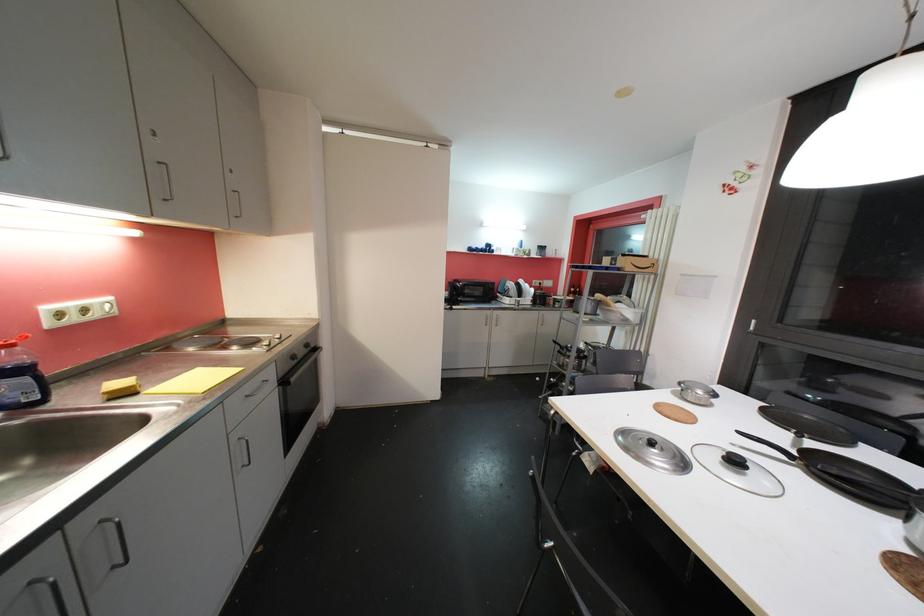
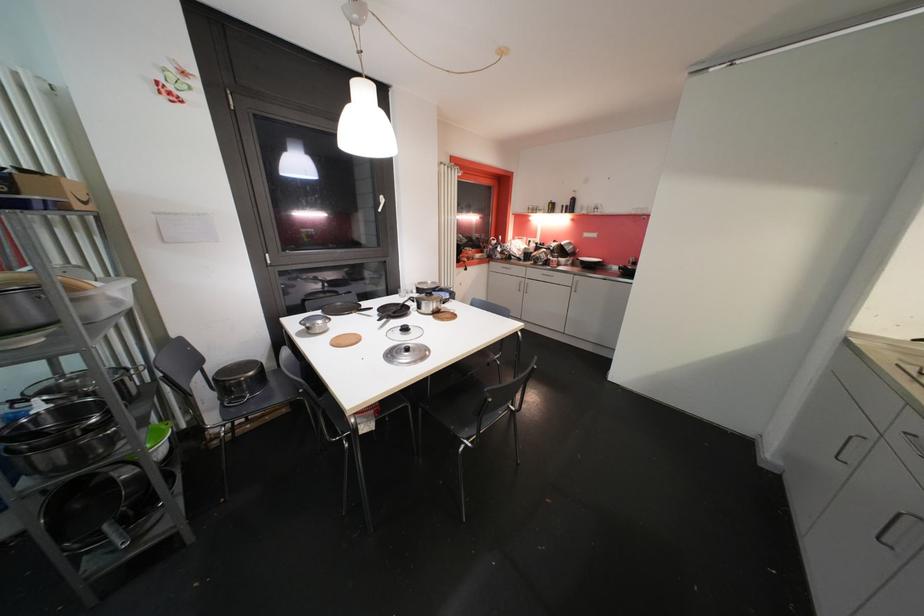
The point at (630, 322) is marked in the first image. Where is the corresponding point in the second image?

(122, 305)